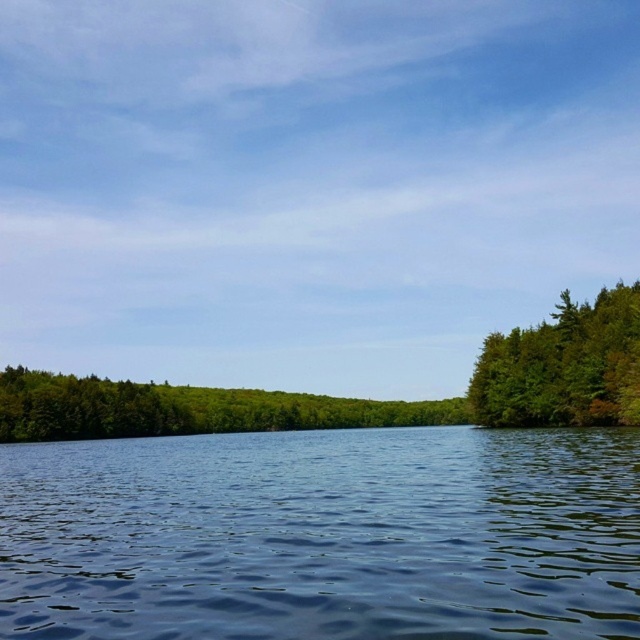
You are standing at the edge of a calm body of water and want to estimate how far the green leafy trees at center are from you. Based on the scene, what is the approximate distance in meters?

The green leafy trees at center are approximately 143.85 meters away from the viewer.

Based on the scene description, where is the green leafy trees at center located in terms of coordinates?

The green leafy trees at center are located at coordinates point (186, 408).

From the picture: You are standing at the point closest to the viewer in the image. Which of the two points, point (353, 634) or point (602, 413), is closer to you?

Point (353, 634) is in front of point (602, 413), so it is closer to you.